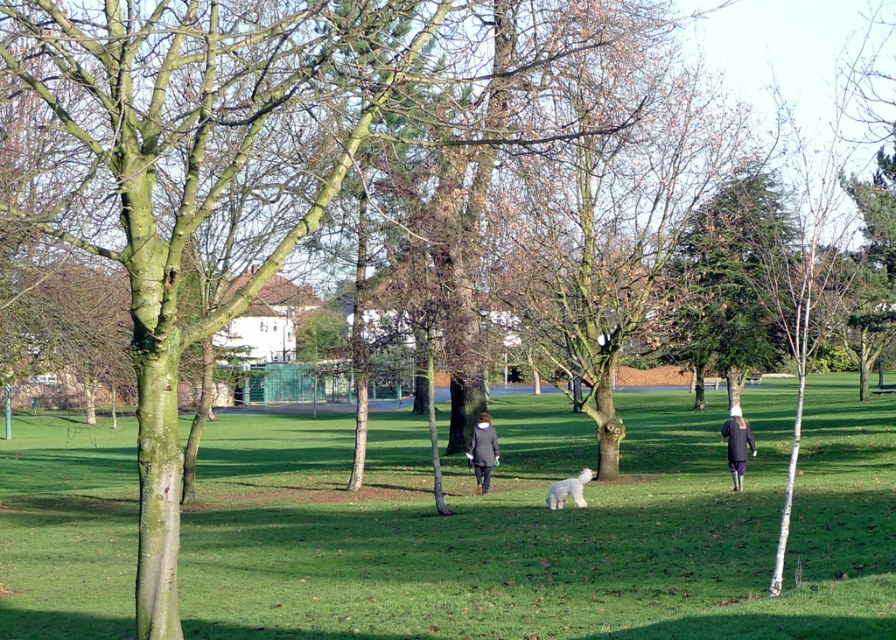
Question: Estimate the real-world distances between objects in this image. Which object is closer to the dark gray wool coat at center?

Choices:
 (A) white fluffy dog at center
 (B) purple fabric pants at right

Answer: (B)

Question: Is dark gray wool coat at center positioned at the back of purple fabric pants at right?

Choices:
 (A) yes
 (B) no

Answer: (A)

Question: Considering the real-world distances, which object is closest to the green grassy at center?

Choices:
 (A) purple fabric pants at right
 (B) dark gray wool coat at center
 (C) white fluffy dog at center

Answer: (B)

Question: From the image, what is the correct spatial relationship of green grassy at center in relation to purple fabric pants at right?

Choices:
 (A) left
 (B) right

Answer: (A)

Question: Is green grassy at center further to the viewer compared to purple fabric pants at right?

Choices:
 (A) yes
 (B) no

Answer: (B)

Question: Which point is farther from the camera taking this photo?

Choices:
 (A) (326, 500)
 (B) (743, 417)
 (C) (487, 444)
 (D) (563, 499)

Answer: (B)